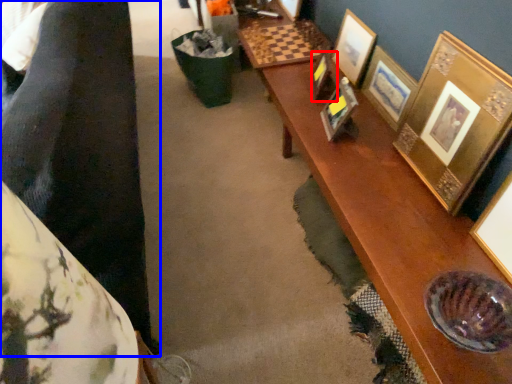
Question: Which object appears farthest to the camera in this image, picture frame (highlighted by a red box) or couple (highlighted by a blue box)?

Choices:
 (A) picture frame
 (B) couple

Answer: (A)